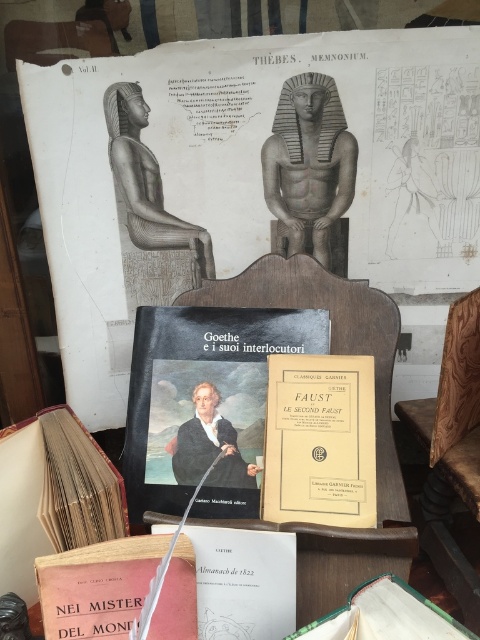
Between point (157, 305) and point (261, 531), which one is positioned behind?

The point (157, 305) is behind.

Which is more to the right, matte black statue at upper left or white paper book at center?

white paper book at center is more to the right.

Is point (177, 220) in front of point (289, 621)?

No, (177, 220) is behind (289, 621).

Where is `matte black statue at upper left`? matte black statue at upper left is located at coordinates (148, 211).

Which is in front, point (177, 108) or point (72, 445)?

Positioned in front is point (72, 445).

Is matte paper poster at upper center to the right of brown leather book at lower left from the viewer's perspective?

Yes, matte paper poster at upper center is to the right of brown leather book at lower left.

Which is in front, point (168, 202) or point (64, 465)?

Positioned in front is point (64, 465).

What are the coordinates of `matte paper poster at upper center` in the screenshot? It's located at (249, 176).

Is point (280, 228) positioned behind point (152, 257)?

No, it is in front of (152, 257).

Image resolution: width=480 pixels, height=640 pixels. What do you see at coordinates (310, 170) in the screenshot?
I see `gray stone statue at center` at bounding box center [310, 170].

Identify the location of gray stone statue at center. (310, 170).